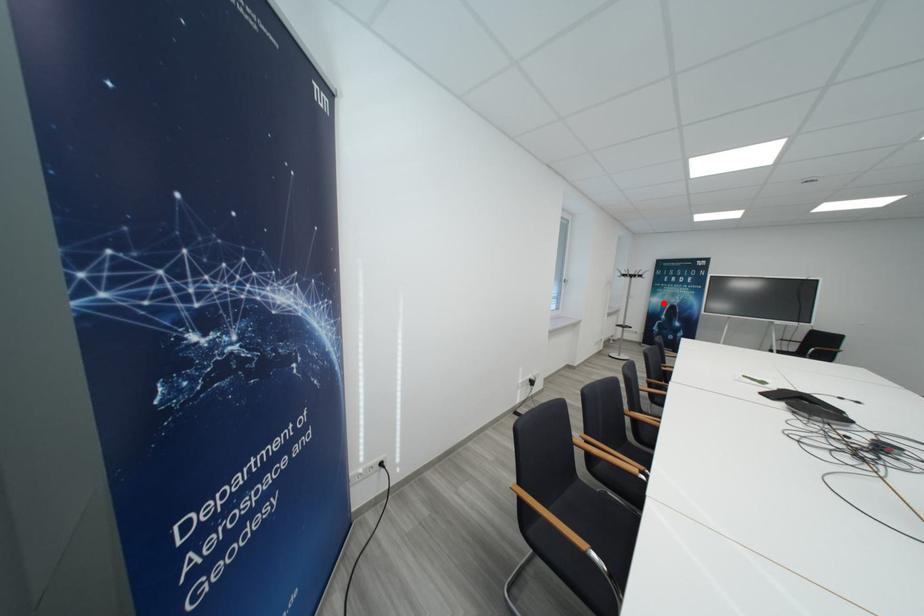
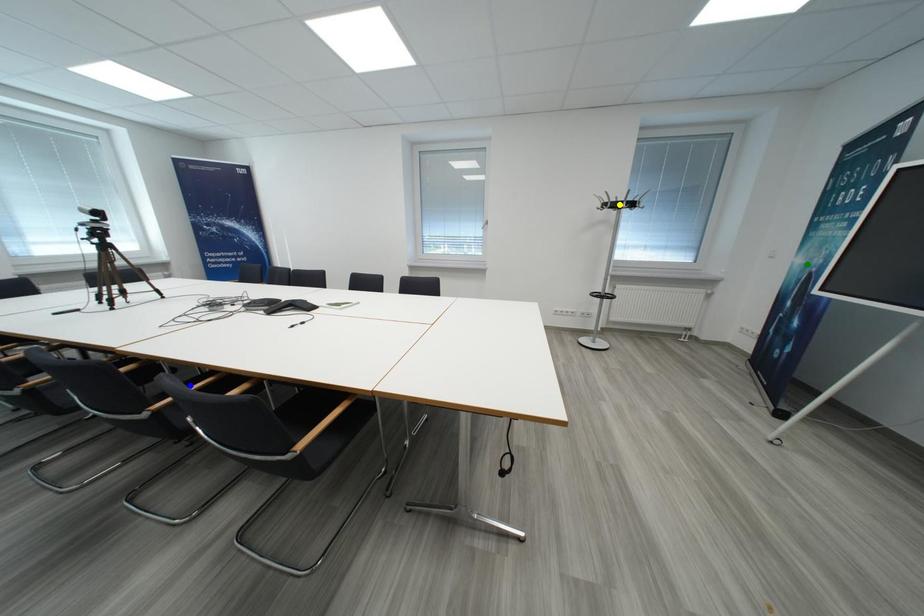
Question: I am providing you with two images of the same scene from different viewpoints. A red point is marked on the first image. You are given multiple points on the second image. Which mark in image 2 goes with the point in image 1?

Choices:
 (A) yellow point
 (B) blue point
 (C) green point

Answer: (C)